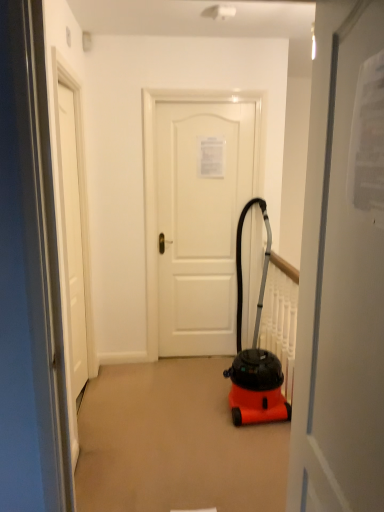
Question: Is white matte door at center, positioned as the 3th door in front-to-back order, with orange matte vacuum cleaner at center?

Choices:
 (A) yes
 (B) no

Answer: (B)

Question: Does white matte door at center, the 1th door when ordered from back to front, have a greater height compared to orange matte vacuum cleaner at center?

Choices:
 (A) no
 (B) yes

Answer: (B)

Question: Is white matte door at center, the 2th door in the left-to-right sequence, looking in the opposite direction of orange matte vacuum cleaner at center?

Choices:
 (A) yes
 (B) no

Answer: (B)

Question: Does white matte door at center, the 2th door in the left-to-right sequence, appear on the right side of orange matte vacuum cleaner at center?

Choices:
 (A) no
 (B) yes

Answer: (A)

Question: Is the depth of white matte door at center, the 2th door in the left-to-right sequence, greater than that of orange matte vacuum cleaner at center?

Choices:
 (A) yes
 (B) no

Answer: (A)

Question: Can you confirm if white matte door at center, the second door when ordered from right to left, is positioned to the left of orange matte vacuum cleaner at center?

Choices:
 (A) yes
 (B) no

Answer: (A)

Question: Is white matte door at center, the 3th door viewed from the left, taller than orange matte vacuum cleaner at center?

Choices:
 (A) yes
 (B) no

Answer: (A)

Question: Is white matte door at center, arranged as the 1th door when viewed from the front, in contact with orange matte vacuum cleaner at center?

Choices:
 (A) no
 (B) yes

Answer: (A)

Question: Is white matte door at center, the 3th door viewed from the left, at the right side of orange matte vacuum cleaner at center?

Choices:
 (A) yes
 (B) no

Answer: (B)

Question: Is white matte door at center, placed as the 3th door when sorted from back to front, not within orange matte vacuum cleaner at center?

Choices:
 (A) yes
 (B) no

Answer: (A)

Question: Does white matte door at center, arranged as the 1th door when viewed from the right, lie behind orange matte vacuum cleaner at center?

Choices:
 (A) yes
 (B) no

Answer: (B)

Question: Is white matte door at center, the 3th door viewed from the left, at the left side of orange matte vacuum cleaner at center?

Choices:
 (A) yes
 (B) no

Answer: (A)

Question: Does white matte door at center, placed as the 3th door when sorted from back to front, appear on the right side of white matte door at center, which ranks as the third door in right-to-left order?

Choices:
 (A) no
 (B) yes

Answer: (B)